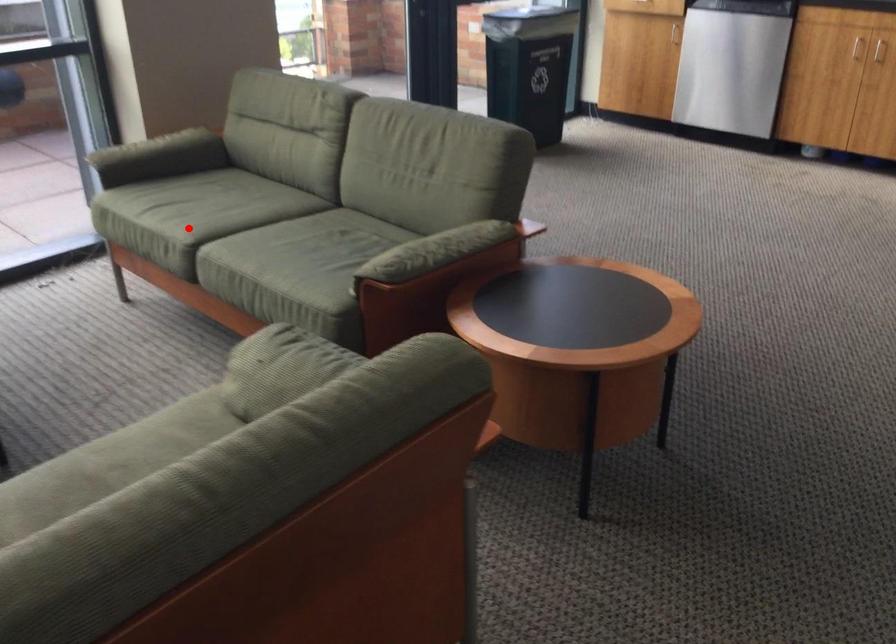
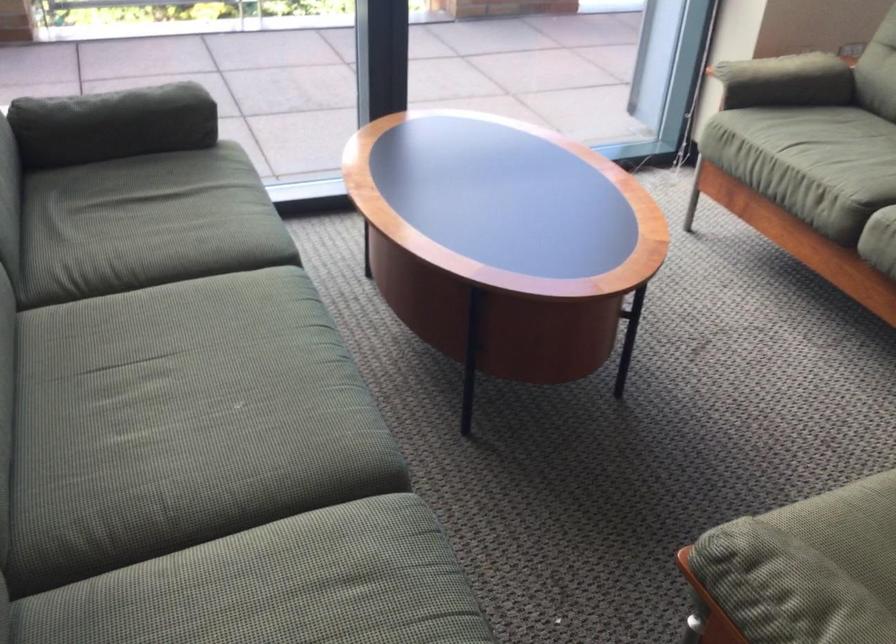
Where in the second image is the point corresponding to the highlighted location from the first image?

(846, 180)